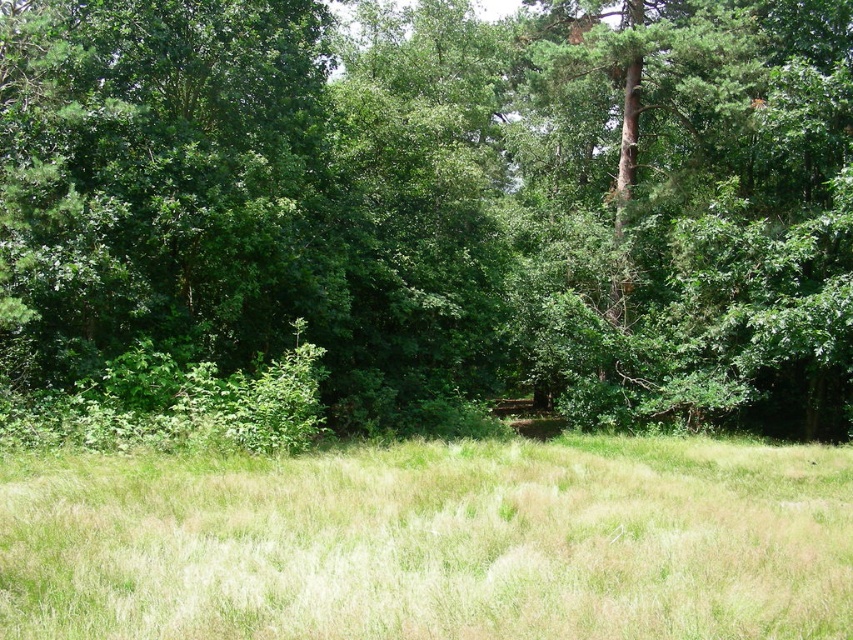
Question: Does green leafy tree at center come in front of green grassy field at center?

Choices:
 (A) yes
 (B) no

Answer: (B)

Question: Which of the following is the closest to the observer?

Choices:
 (A) green leafy tree at center
 (B) green grassy field at center

Answer: (B)

Question: Which point is farther to the camera?

Choices:
 (A) (397, 243)
 (B) (426, 452)

Answer: (A)

Question: Is green leafy tree at center above green grassy field at center?

Choices:
 (A) yes
 (B) no

Answer: (A)

Question: Is green leafy tree at center closer to the viewer compared to green grassy field at center?

Choices:
 (A) no
 (B) yes

Answer: (A)